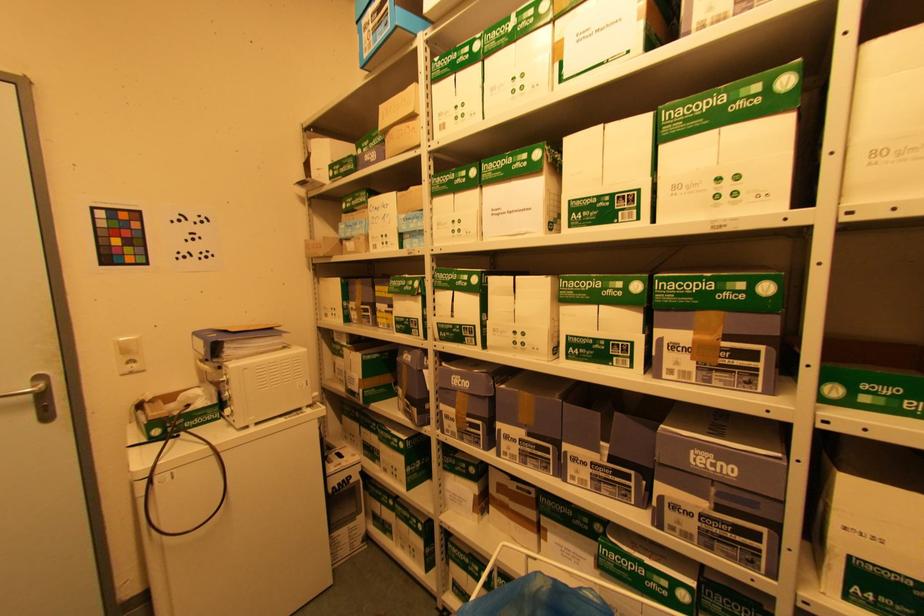
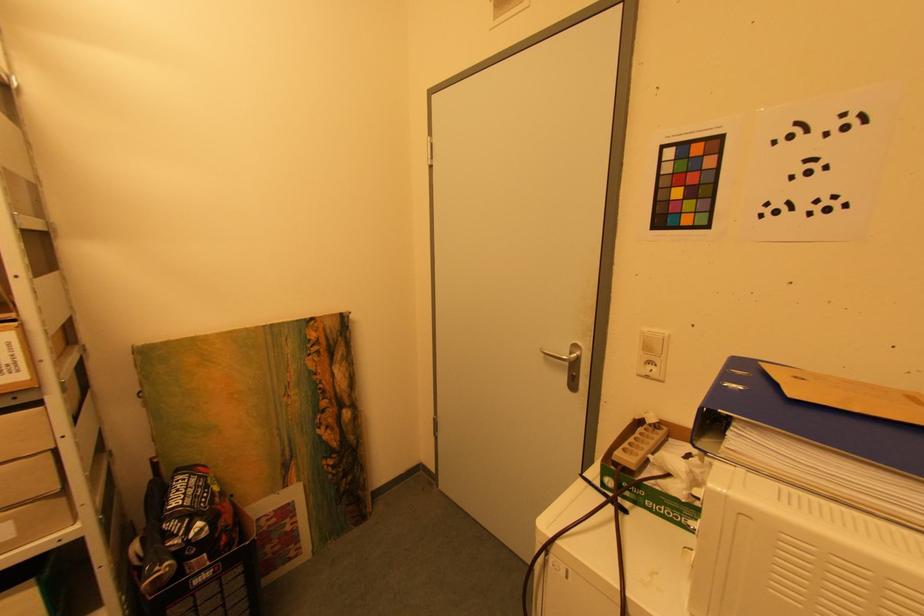
Question: The camera is either moving clockwise (left) or counter-clockwise (right) around the object. The first image is from the beginning of the video and the second image is from the end. Is the camera moving left or right when shooting the video?

Choices:
 (A) Left
 (B) Right

Answer: (B)